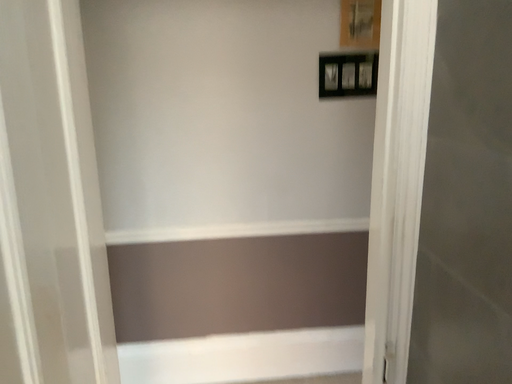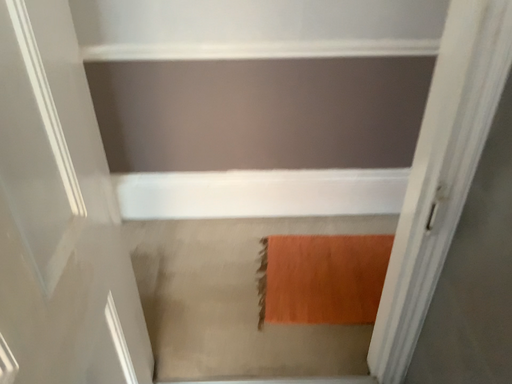
Question: Which way did the camera rotate in the video?

Choices:
 (A) rotated downward
 (B) rotated upward

Answer: (A)